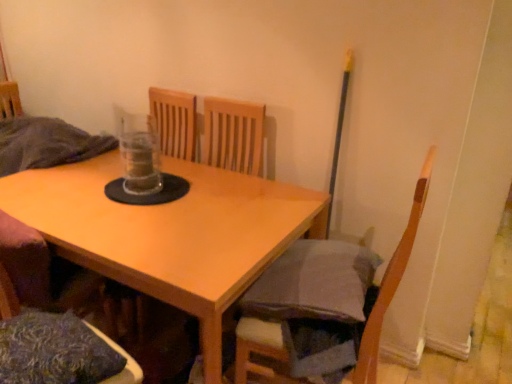
Question: Does point (74, 382) appear closer or farther from the camera than point (264, 334)?

Choices:
 (A) farther
 (B) closer

Answer: (B)

Question: From the image's perspective, relative to wooden chair at lower right, which ranks as the 2th chair in left-to-right order, is textured blue pillow at lower left above or below?

Choices:
 (A) above
 (B) below

Answer: (B)

Question: Which object is positioned farthest from the wooden chair at lower left, acting as the 2th chair starting from the right?

Choices:
 (A) textured blue pillow at lower left
 (B) light wood table at center
 (C) wooden chair at lower right, marked as the 1th chair in a right-to-left arrangement

Answer: (C)

Question: Which is farther from the light wood table at center?

Choices:
 (A) textured blue pillow at lower left
 (B) wooden chair at lower left, acting as the 2th chair starting from the right
 (C) wooden chair at lower right, which ranks as the 2th chair in left-to-right order

Answer: (C)